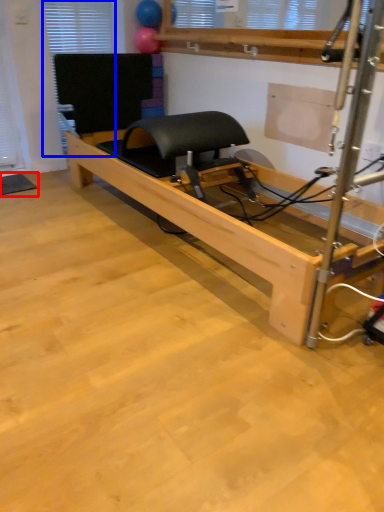
Question: Which object is closer to the camera taking this photo, yoga mat (highlighted by a red box) or window (highlighted by a blue box)?

Choices:
 (A) yoga mat
 (B) window

Answer: (A)